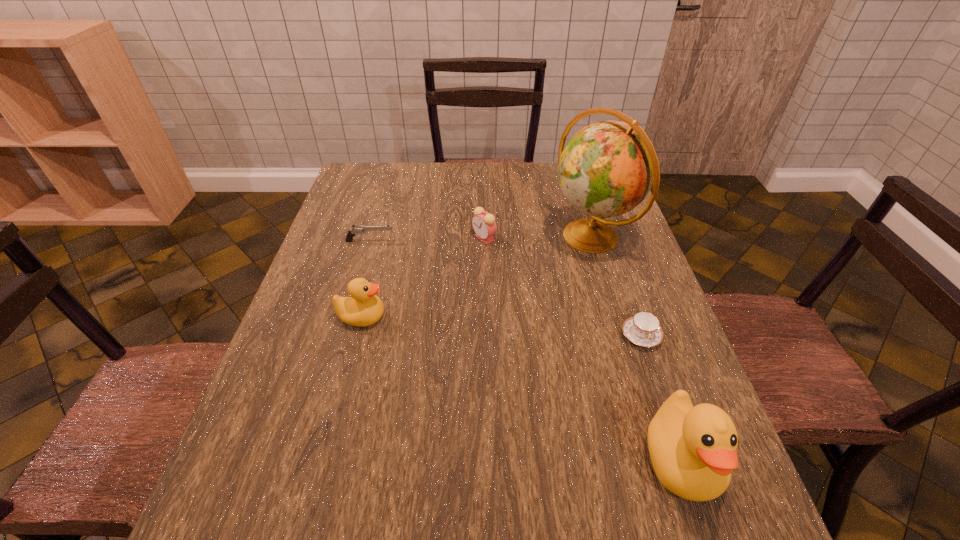
You are a GUI agent. You are given a task and a screenshot of the screen. Output one action in this format:
    pyautogui.click(x=<x>, y=<y>)
    Task: Click on the globe present at the right edge
    This screenshot has width=960, height=540.
    Given the screenshot: What is the action you would take?
    pyautogui.click(x=606, y=169)

Locate an element on the screen. The width and height of the screenshot is (960, 540). teacup positioned at the right edge is located at coordinates (643, 329).

Identify the location of object that is at the near right corner. (693, 450).

The image size is (960, 540). I want to click on vacant space at the far edge of the desktop, so click(x=540, y=195).

Locate an element on the screen. blank space at the near edge of the desktop is located at coordinates (358, 452).

Find the location of `vacant region at the left edge of the desktop`. vacant region at the left edge of the desktop is located at coordinates (379, 209).

Locate an element on the screen. This screenshot has height=540, width=960. vacant space at the right edge of the desktop is located at coordinates (659, 373).

The image size is (960, 540). In the image, there is a desktop. Find the location of `vacant space at the far left corner`. vacant space at the far left corner is located at coordinates (389, 175).

Identify the location of vacant space at the near left corner of the desktop. (268, 448).

Identify the location of vacant space that's between the shortest object and the alarm clock. Image resolution: width=960 pixels, height=540 pixels. (563, 287).